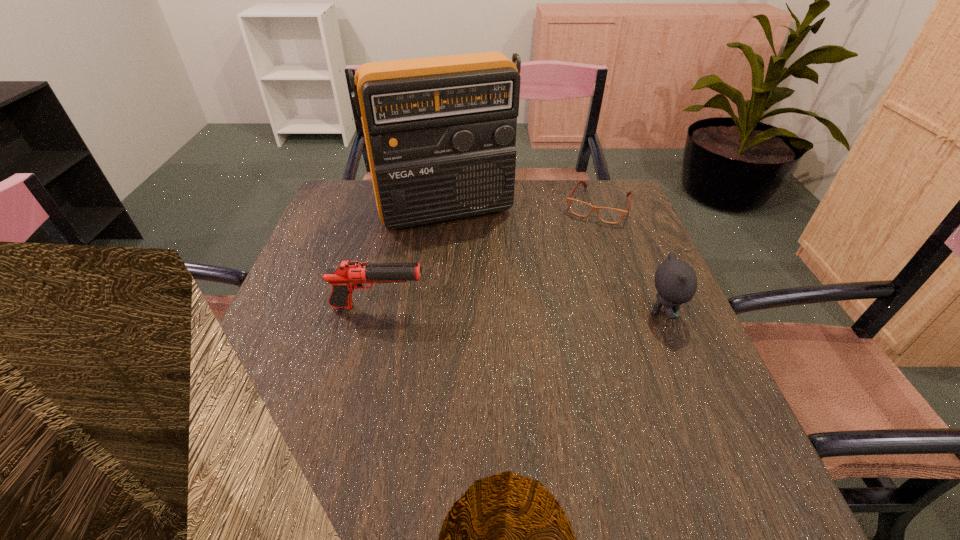
Identify the location of free spot on the desktop that is between the gun and the kitten and is positioned on the front-facing side of the spectacles. (547, 310).

Find the location of a particular element. This screenshot has height=540, width=960. vacant space on the desktop that is between the gun and the kitten and is positioned on the front-facing side of the radio receiver is located at coordinates (490, 309).